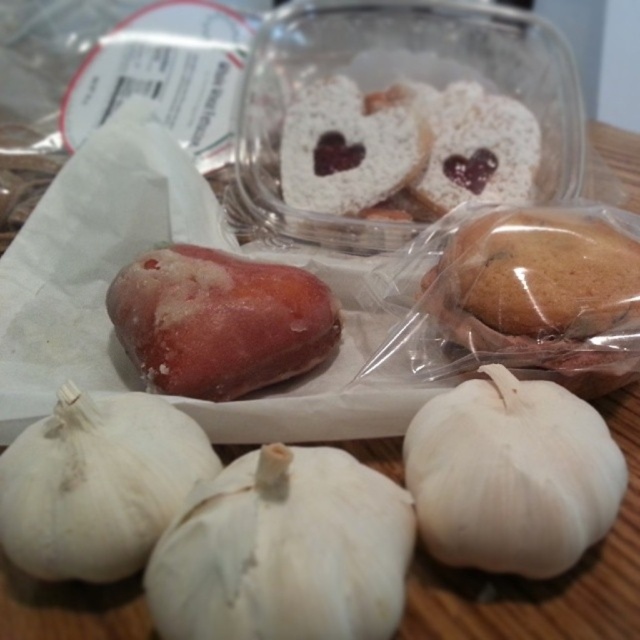
Question: Can you confirm if white matte garlic at lower center is bigger than white matte garlic at lower left?

Choices:
 (A) yes
 (B) no

Answer: (A)

Question: Among these objects, which one is farthest from the camera?

Choices:
 (A) white matte garlic at lower left
 (B) white matte garlic at center
 (C) frozen pinkish-red apple at center-left

Answer: (C)

Question: Is the position of white matte garlic at center less distant than that of white matte garlic at lower left?

Choices:
 (A) yes
 (B) no

Answer: (A)

Question: Considering the relative positions of white matte garlic at lower center and white matte garlic at lower left in the image provided, where is white matte garlic at lower center located with respect to white matte garlic at lower left?

Choices:
 (A) right
 (B) left

Answer: (A)

Question: Which point is closer to the camera taking this photo?

Choices:
 (A) (445, 410)
 (B) (186, 445)
 (C) (294, 608)
 (D) (278, 275)

Answer: (C)

Question: Estimate the real-world distances between objects in this image. Which object is farther from the white matte garlic at center?

Choices:
 (A) white matte garlic at lower left
 (B) frozen pinkish-red apple at center-left

Answer: (B)